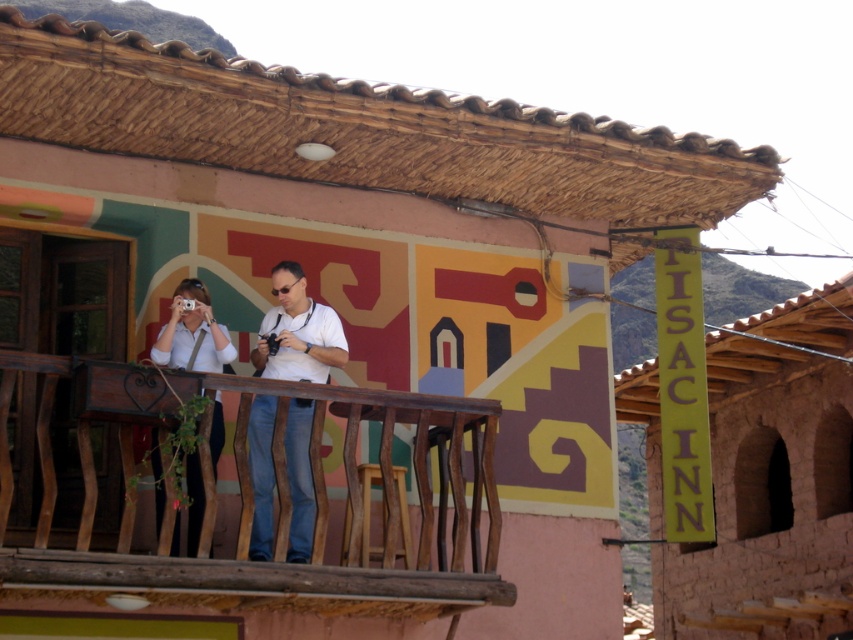
Question: Does white matte shirt at center appear under white matte shirt at left?

Choices:
 (A) no
 (B) yes

Answer: (B)

Question: Estimate the real-world distances between objects in this image. Which object is closer to the white matte shirt at center?

Choices:
 (A) brown wooden balcony at center
 (B) white matte shirt at left

Answer: (B)

Question: Among these objects, which one is farthest from the camera?

Choices:
 (A) white matte shirt at center
 (B) white matte shirt at left

Answer: (A)

Question: Which point is farther to the camera?

Choices:
 (A) white matte shirt at center
 (B) brown wooden balcony at center
 (C) white matte shirt at left

Answer: (A)

Question: Does white matte shirt at center have a greater width compared to white matte shirt at left?

Choices:
 (A) yes
 (B) no

Answer: (A)

Question: Can you confirm if brown wooden balcony at center is smaller than white matte shirt at center?

Choices:
 (A) no
 (B) yes

Answer: (B)